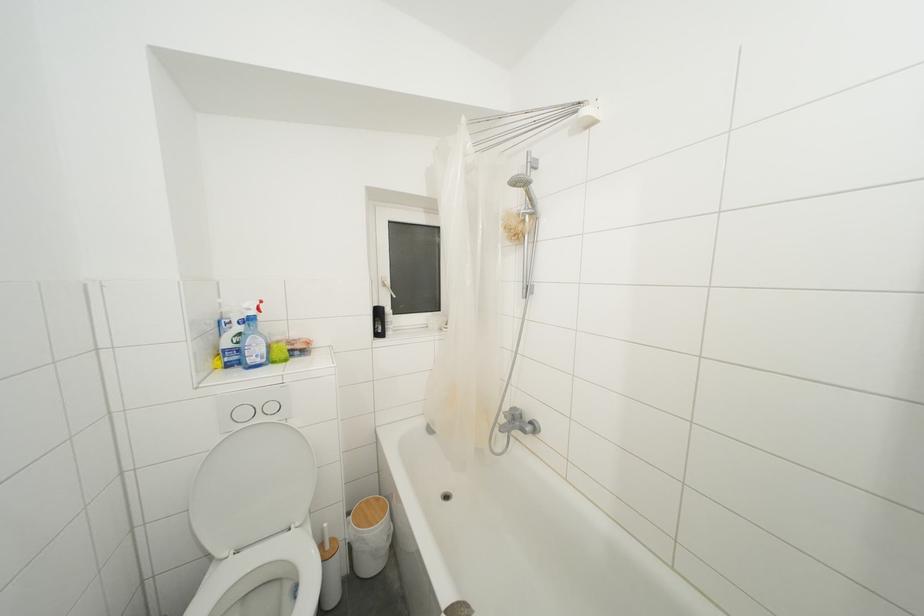
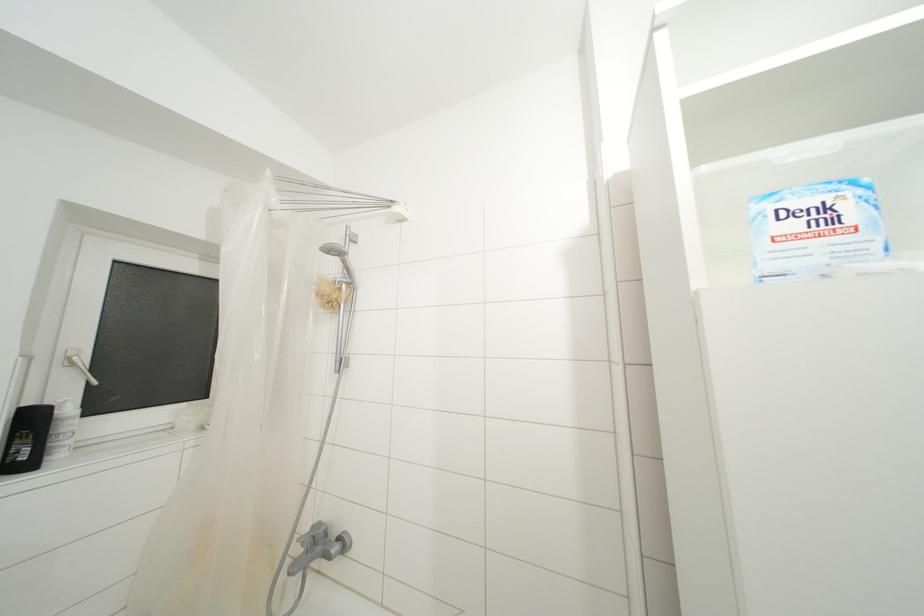
Question: The first image is from the beginning of the video and the second image is from the end. How did the camera likely rotate when shooting the video?

Choices:
 (A) Left
 (B) Right
 (C) Up
 (D) Down

Answer: (B)